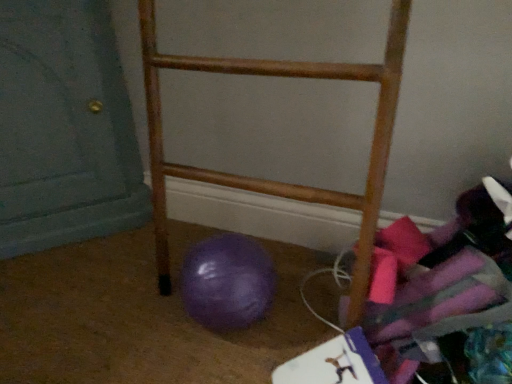
Question: Is purple rubber ball at lower left smaller than matte teal door at lower left?

Choices:
 (A) yes
 (B) no

Answer: (A)

Question: Does purple rubber ball at lower left have a larger size compared to matte teal door at lower left?

Choices:
 (A) yes
 (B) no

Answer: (B)

Question: From a real-world perspective, is purple rubber ball at lower left over matte teal door at lower left?

Choices:
 (A) yes
 (B) no

Answer: (B)

Question: Is purple rubber ball at lower left not close to matte teal door at lower left?

Choices:
 (A) no
 (B) yes

Answer: (A)

Question: Does purple rubber ball at lower left have a greater width compared to matte teal door at lower left?

Choices:
 (A) no
 (B) yes

Answer: (A)

Question: Is purple rubber ball at lower left taller than matte teal door at lower left?

Choices:
 (A) no
 (B) yes

Answer: (A)

Question: Considering the relative sizes of wooden rack at center and matte teal door at lower left in the image provided, is wooden rack at center smaller than matte teal door at lower left?

Choices:
 (A) no
 (B) yes

Answer: (B)

Question: Is wooden rack at center positioned with its back to matte teal door at lower left?

Choices:
 (A) no
 (B) yes

Answer: (A)

Question: Does wooden rack at center have a greater width compared to matte teal door at lower left?

Choices:
 (A) yes
 (B) no

Answer: (B)

Question: Is matte teal door at lower left surrounded by wooden rack at center?

Choices:
 (A) yes
 (B) no

Answer: (B)

Question: Does wooden rack at center come in front of matte teal door at lower left?

Choices:
 (A) yes
 (B) no

Answer: (A)

Question: Is wooden rack at center bigger than matte teal door at lower left?

Choices:
 (A) no
 (B) yes

Answer: (A)

Question: Can you confirm if purple rubber ball at lower left is shorter than wooden rack at center?

Choices:
 (A) no
 (B) yes

Answer: (B)